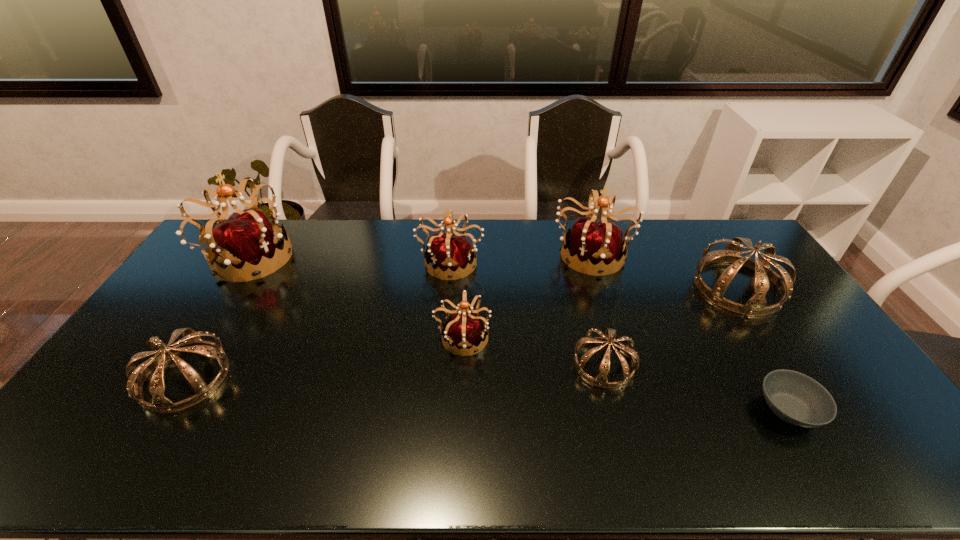
The height and width of the screenshot is (540, 960). Find the location of `free space that is in between the second biggest brown tiara and the second smallest red tiara`. free space that is in between the second biggest brown tiara and the second smallest red tiara is located at coordinates (x=318, y=320).

Find the location of `empty space between the farthest brown tiara and the second tallest object`. empty space between the farthest brown tiara and the second tallest object is located at coordinates (664, 270).

You are a GUI agent. You are given a task and a screenshot of the screen. Output one action in this format:
    pyautogui.click(x=<x>, y=<y>)
    Task: Click on the blank region between the second tallest object and the second biggest brown tiara
    The height and width of the screenshot is (540, 960).
    Given the screenshot: What is the action you would take?
    pyautogui.click(x=388, y=315)

Find the location of `empty space between the smallest red tiara and the tallest tiara`. empty space between the smallest red tiara and the tallest tiara is located at coordinates (355, 298).

At what (x,y) coordinates should I click in order to perform the action: click on free space between the seventh tallest object and the shortest object. Please return your answer as a coordinate pair (x, y). Looking at the image, I should click on (696, 387).

Find the location of a particular element. The height and width of the screenshot is (540, 960). unoccupied position between the biggest red tiara and the second shortest object is located at coordinates (426, 310).

I want to click on vacant area that lies between the second biggest brown tiara and the nearest red tiara, so (324, 357).

Find the location of `free spot between the smallest brown tiara and the leftmost brown tiara`. free spot between the smallest brown tiara and the leftmost brown tiara is located at coordinates (395, 370).

At what (x,y) coordinates should I click in order to perform the action: click on free space between the third biggest red tiara and the second biggest red tiara. Please return your answer as a coordinate pair (x, y). The width and height of the screenshot is (960, 540). Looking at the image, I should click on (521, 257).

This screenshot has width=960, height=540. I want to click on object that is the fourth closest to the smallest red tiara, so click(245, 243).